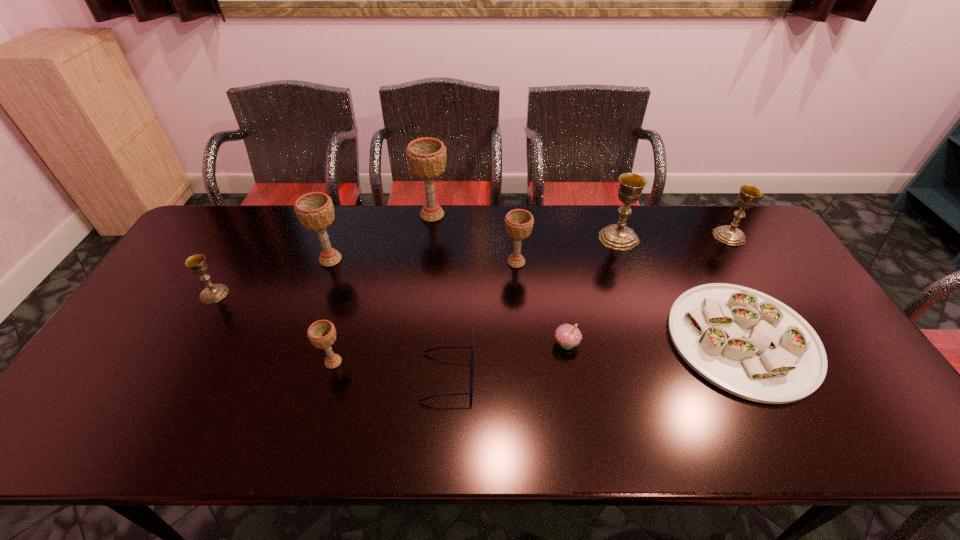
At what (x,y) coordinates should I click in order to perform the action: click on the leftmost object. Please return your answer as a coordinate pair (x, y). This screenshot has height=540, width=960. Looking at the image, I should click on (213, 293).

The height and width of the screenshot is (540, 960). Identify the location of the second nearest chalice. (213, 293).

At what (x,y) coordinates should I click in order to perform the action: click on the nearest beige chalice. Please return your answer as a coordinate pair (x, y). The width and height of the screenshot is (960, 540). Looking at the image, I should click on (322, 334).

At what (x,y) coordinates should I click in order to perform the action: click on the third chalice from left to right. Please return your answer as a coordinate pair (x, y). This screenshot has height=540, width=960. Looking at the image, I should click on pyautogui.click(x=322, y=334).

Find the location of a particular element. the fourth object from right to left is located at coordinates (568, 336).

At what (x,y) coordinates should I click in order to perform the action: click on the third shortest object. Please return your answer as a coordinate pair (x, y). The height and width of the screenshot is (540, 960). Looking at the image, I should click on (568, 336).

This screenshot has width=960, height=540. Identify the location of white platter. (747, 343).

Where is `platter`? platter is located at coordinates (747, 343).

Where is `spectacles`? The height and width of the screenshot is (540, 960). spectacles is located at coordinates (471, 390).

This screenshot has width=960, height=540. I want to click on free space located 0.140m on the left of the biggest beige chalice, so click(x=374, y=215).